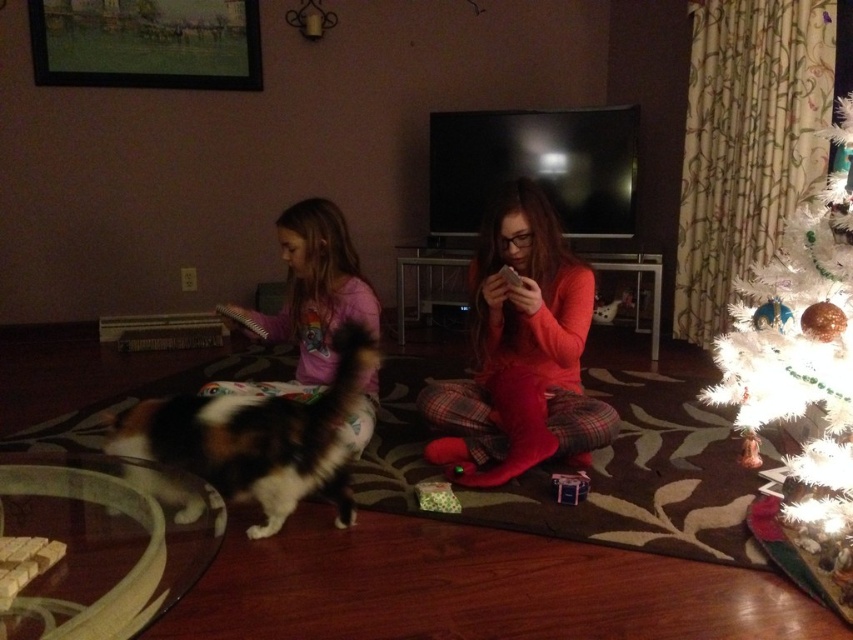
You are helping organize a holiday photo shoot and need to ensure the two people in the scene are positioned appropriately. The photographer wants to know if the person in the matte red pajamas at center can move closer to the pink fleece pajamas at left without overlapping them. Based on their sizes, is this possible?

The matte red pajamas at center is wider than the pink fleece pajamas at left. Since the matte red pajamas at center is larger in width, there is enough space for them to move closer to the pink fleece pajamas at left without overlapping.

You are a guest in this living room and want to sit down. There is a space between the matte red pajamas at center and the white artificial christmas tree at right. Is the space wide enough for you to sit comfortably?

The matte red pajamas at center has a lesser height compared to white artificial christmas tree at right, so the space between them may be sufficient for sitting comfortably.